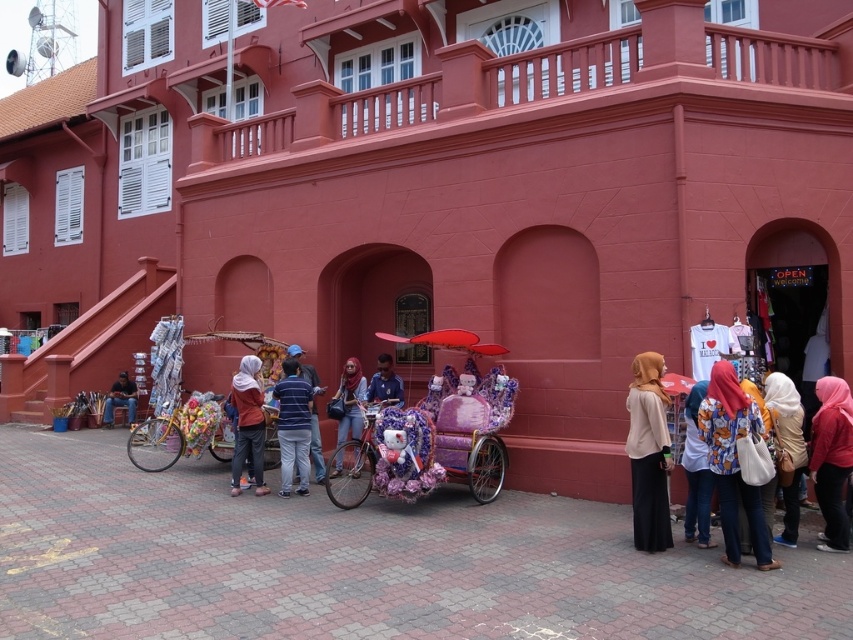
Question: Is matte red jacket at center above blue fabric shirt at center?

Choices:
 (A) no
 (B) yes

Answer: (A)

Question: Is purple floral cart at center closer to the viewer compared to pink fabric headscarf at lower right?

Choices:
 (A) yes
 (B) no

Answer: (B)

Question: Which point is farther from the camera taking this photo?

Choices:
 (A) (387, 488)
 (B) (788, 538)
 (C) (840, 412)

Answer: (A)

Question: Among these objects, which one is farthest from the camera?

Choices:
 (A) pink fabric headscarf at lower right
 (B) beige fabric hijab at center
 (C) matte purple scarf at center

Answer: (C)

Question: Estimate the real-world distances between objects in this image. Which object is closer to the pink fabric headscarf at lower right?

Choices:
 (A) floral fabric shirt at center
 (B) matte red jacket at center

Answer: (A)

Question: Is printed fabric headscarf at lower right to the left of floral fabric shirt at center from the viewer's perspective?

Choices:
 (A) no
 (B) yes

Answer: (A)